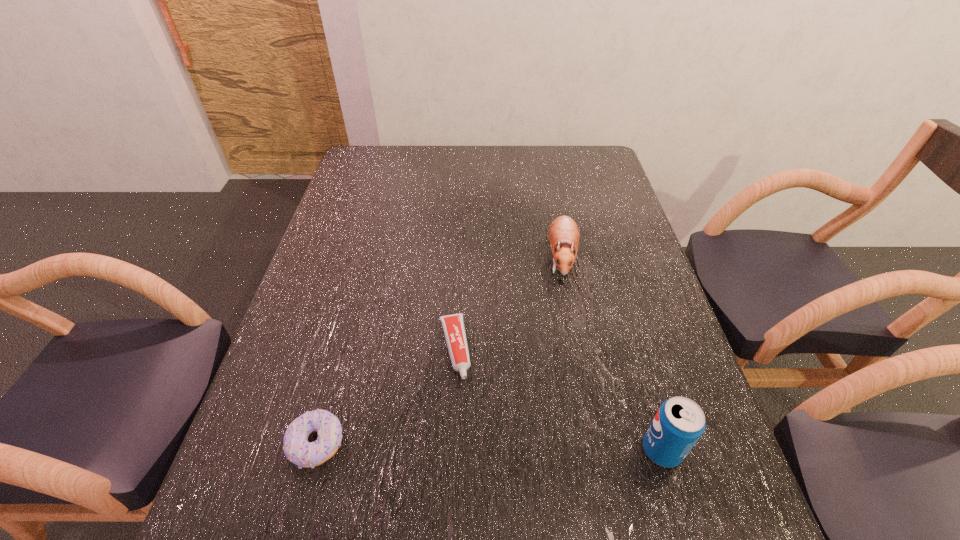
This screenshot has height=540, width=960. I want to click on free point located at the nozzle of the second object from left to right, so click(471, 458).

Locate an element on the screen. Image resolution: width=960 pixels, height=540 pixels. vacant region located 0.120m at the nozzle of the second object from left to right is located at coordinates (467, 434).

Where is `vacant space situated 0.200m at the nozzle of the second object from left to right`? This screenshot has width=960, height=540. vacant space situated 0.200m at the nozzle of the second object from left to right is located at coordinates (474, 474).

This screenshot has height=540, width=960. I want to click on free region located at the face of the farthest object, so click(x=543, y=425).

I want to click on vacant area located at the face of the farthest object, so click(x=546, y=403).

Identify the location of vacant area situated at the face of the farthest object. This screenshot has height=540, width=960. (555, 342).

Find the location of a particular element. Image resolution: width=960 pixels, height=540 pixels. doughnut present at the near edge is located at coordinates (297, 449).

At what (x,y) coordinates should I click in order to perform the action: click on soda can present at the near edge. Please return your answer as a coordinate pair (x, y). Looking at the image, I should click on (679, 423).

The height and width of the screenshot is (540, 960). What are the coordinates of `object present at the left edge` in the screenshot? It's located at (297, 449).

Locate an element on the screen. object present at the right edge is located at coordinates (679, 423).